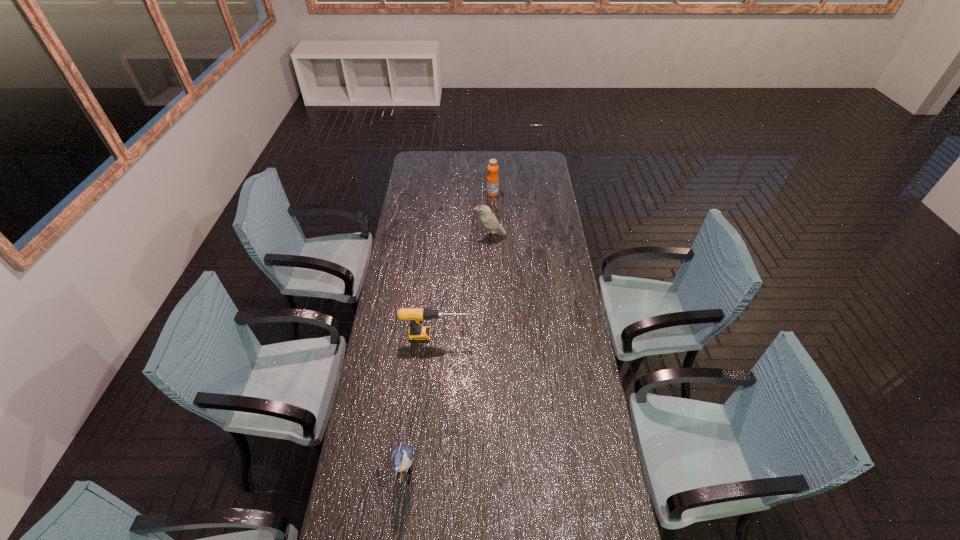
Image resolution: width=960 pixels, height=540 pixels. Identify the location of vacant space positioned at the tip of the nearest object's beak. (485, 475).

You are a GUI agent. You are given a task and a screenshot of the screen. Output one action in this format:
    pyautogui.click(x=<x>, y=<y>)
    Task: Click on the blank area located 0.050m on the handle side of the second nearest object
    This screenshot has width=960, height=540.
    Given the screenshot: What is the action you would take?
    pyautogui.click(x=480, y=335)

The image size is (960, 540). Identify the location of bird located in the left edge section of the desktop. (402, 456).

What are the coordinates of `drill at the left edge` in the screenshot? It's located at (416, 315).

This screenshot has height=540, width=960. In the image, there is a desktop. In order to click on free space at the left edge in this screenshot , I will do `click(377, 372)`.

Identify the location of free space at the right edge of the desktop. (584, 393).

At what (x,y) coordinates should I click in order to perform the action: click on vacant region at the far right corner of the desktop. Please return your answer as a coordinate pair (x, y). This screenshot has height=540, width=960. Looking at the image, I should click on (544, 167).

Identify the location of vacant point located between the second nearest object and the third nearest object. The image size is (960, 540). (462, 286).

Identify the location of free space between the farthest object and the nearer bird. This screenshot has height=540, width=960. (448, 334).

Find the location of `free space that is in between the farther bird and the drill`. free space that is in between the farther bird and the drill is located at coordinates (462, 286).